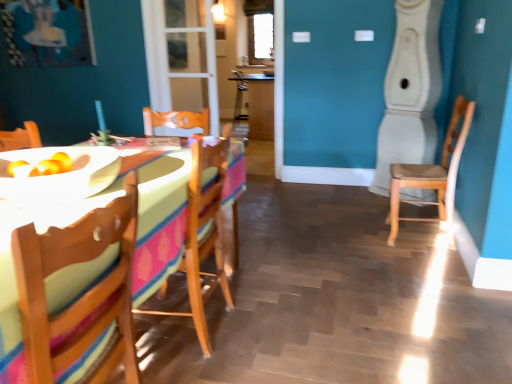
Question: Considering the positions of transparent glass door at center and wooden table at center in the image, is transparent glass door at center wider or thinner than wooden table at center?

Choices:
 (A) thin
 (B) wide

Answer: (A)

Question: In terms of height, does transparent glass door at center look taller or shorter compared to wooden table at center?

Choices:
 (A) tall
 (B) short

Answer: (A)

Question: Which of these objects is positioned farthest from the wooden chair at left, which is counted as the third chair, starting from the back?

Choices:
 (A) clear glass window at upper center
 (B) white glossy bowl at center
 (C) wooden table at center
 (D) wooden chair at center, the second chair viewed from the left
 (E) transparent glass door at center

Answer: (A)

Question: Which object is the closest to the white glossy bowl at center?

Choices:
 (A) wooden chair at left, which is counted as the third chair, starting from the back
 (B) wooden chair at center, which ranks as the 2th chair in back-to-front order
 (C) wooden chair at right, the 1th chair in the right-to-left sequence
 (D) wooden table at left
 (E) transparent glass door at center

Answer: (D)